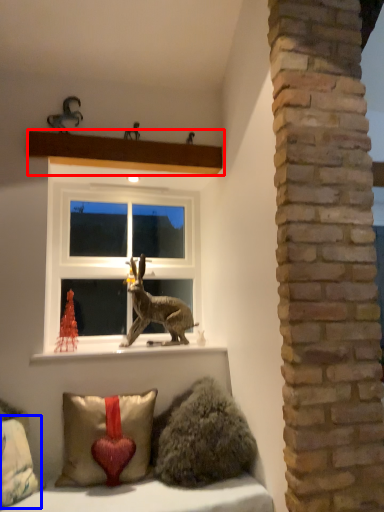
Question: Which of the following is the closest to the observer, shelf (highlighted by a red box) or pillow (highlighted by a blue box)?

Choices:
 (A) shelf
 (B) pillow

Answer: (B)